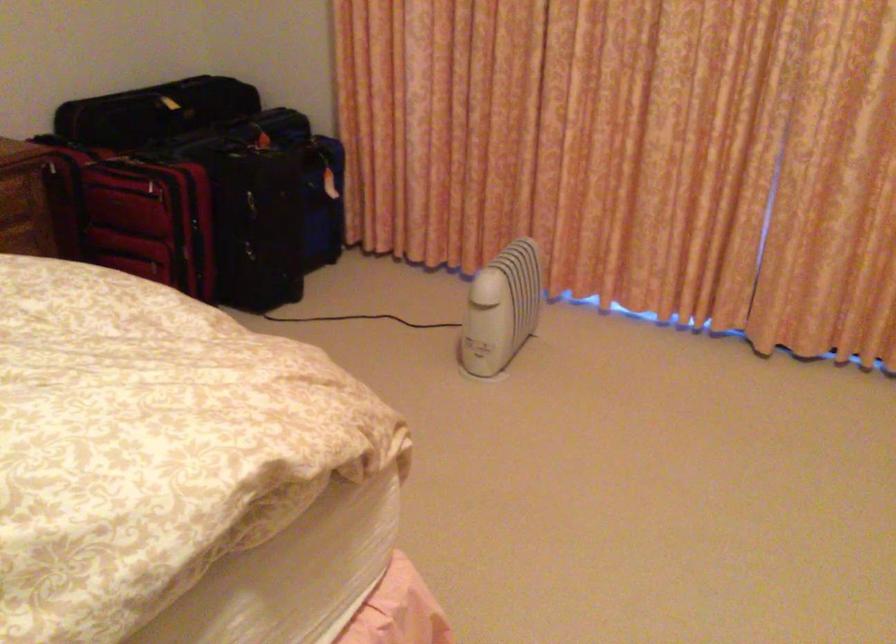
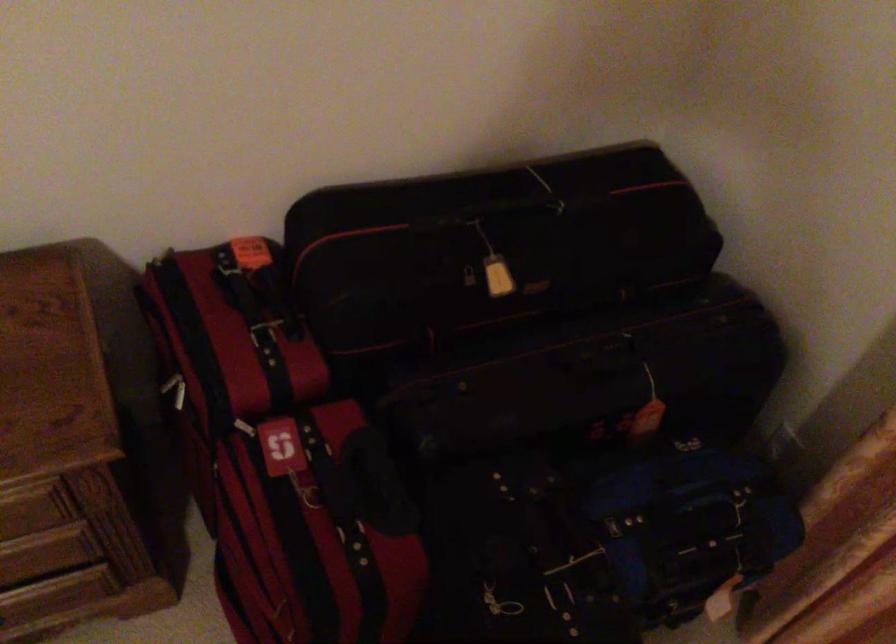
Locate, in the second image, the point that corresponds to point (295, 142) in the first image.

(676, 507)